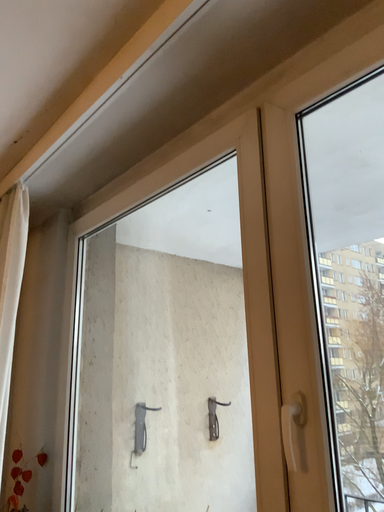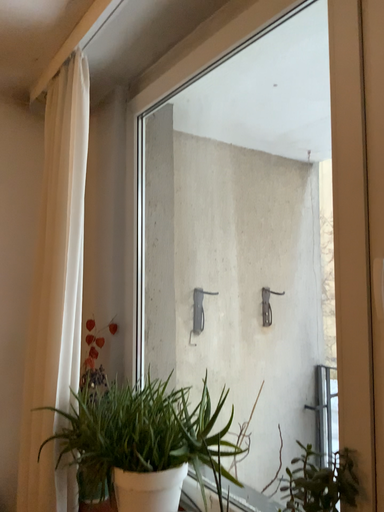
Question: Which way did the camera rotate in the video?

Choices:
 (A) rotated upward
 (B) rotated downward

Answer: (B)